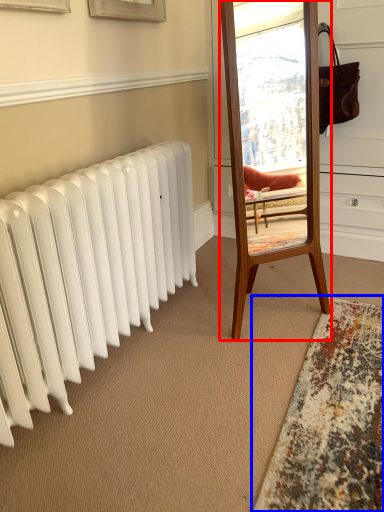
Question: Which object is closer to the camera taking this photo, mirror (highlighted by a red box) or mat (highlighted by a blue box)?

Choices:
 (A) mirror
 (B) mat

Answer: (B)